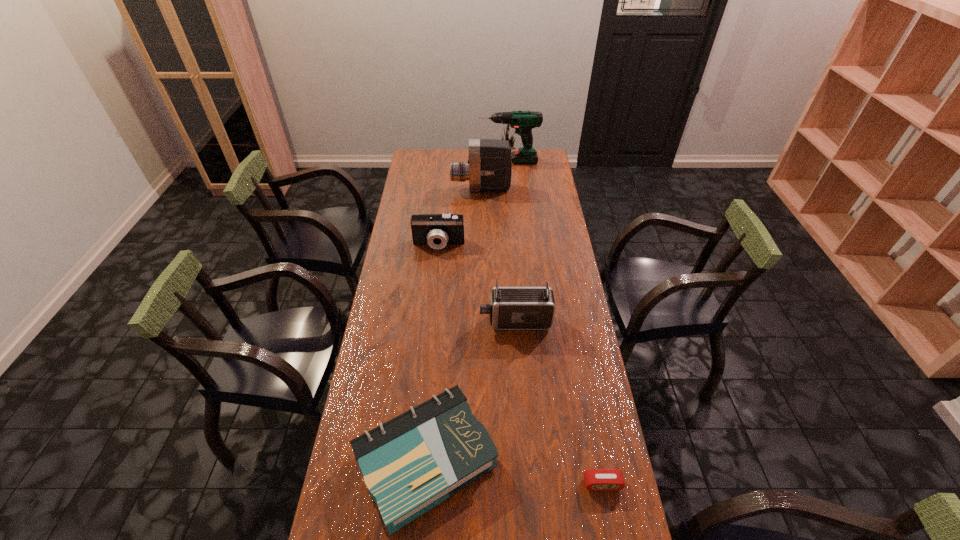
The height and width of the screenshot is (540, 960). Identify the location of the farthest object. pyautogui.click(x=523, y=121).

This screenshot has height=540, width=960. In order to click on the farthest camcorder in this screenshot , I will do `click(489, 168)`.

At what (x,y) coordinates should I click in order to perform the action: click on the tallest camcorder. Please return your answer as a coordinate pair (x, y). The image size is (960, 540). Looking at the image, I should click on point(489,168).

Locate an element on the screen. the nearest camcorder is located at coordinates (511, 308).

Where is `the fourth farthest object`? the fourth farthest object is located at coordinates (511, 308).

The width and height of the screenshot is (960, 540). Find the location of `the second nearest camcorder`. the second nearest camcorder is located at coordinates (437, 230).

Locate an element on the screen. Image resolution: width=960 pixels, height=540 pixels. the fourth tallest object is located at coordinates (437, 230).

Find the location of a particular element. the fifth tallest object is located at coordinates (410, 464).

Where is `the shortest object`? the shortest object is located at coordinates (595, 479).

This screenshot has width=960, height=540. I want to click on vacant region located 0.290m on the handle side of the farthest object, so point(424,161).